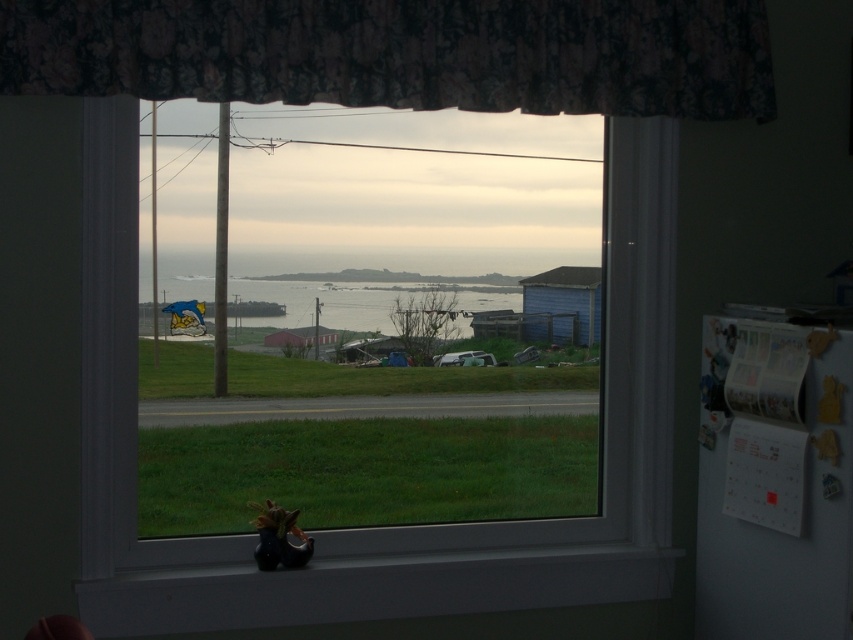
Who is positioned more to the left, floral fabric curtain at upper center or transparent glass window at center?

transparent glass window at center is more to the left.

Is floral fabric curtain at upper center positioned at the back of transparent glass window at center?

No, it is in front of transparent glass window at center.

Who is more distant from viewer, [456,33] or [637,211]?

The point [637,211] is behind.

Locate an element on the screen. floral fabric curtain at upper center is located at coordinates (402, 52).

Between transparent glass window at center and black matte window sill at lower center, which one is positioned lower?

Positioned lower is black matte window sill at lower center.

What do you see at coordinates (604, 417) in the screenshot? This screenshot has width=853, height=640. I see `transparent glass window at center` at bounding box center [604, 417].

Where is `transparent glass window at center`? The height and width of the screenshot is (640, 853). transparent glass window at center is located at coordinates (604, 417).

Which is above, transparent glass window at center or clear water at center?

clear water at center is higher up.

Can you confirm if transparent glass window at center is thinner than clear water at center?

Incorrect, transparent glass window at center's width is not less than clear water at center's.

Between point (641, 532) and point (206, 300), which one is positioned behind?

Point (206, 300)

This screenshot has width=853, height=640. What are the coordinates of `transparent glass window at center` in the screenshot? It's located at (604, 417).